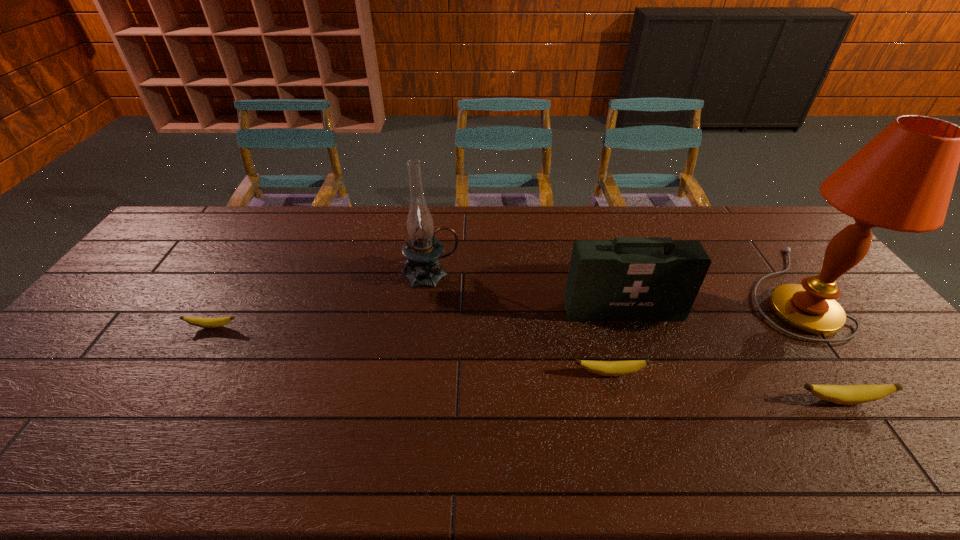
At what (x,y) coordinates should I click in order to perform the action: click on spot to insert another banana for uniform distribution. Please return your answer as a coordinate pair (x, y). The image size is (960, 540). Looking at the image, I should click on (401, 349).